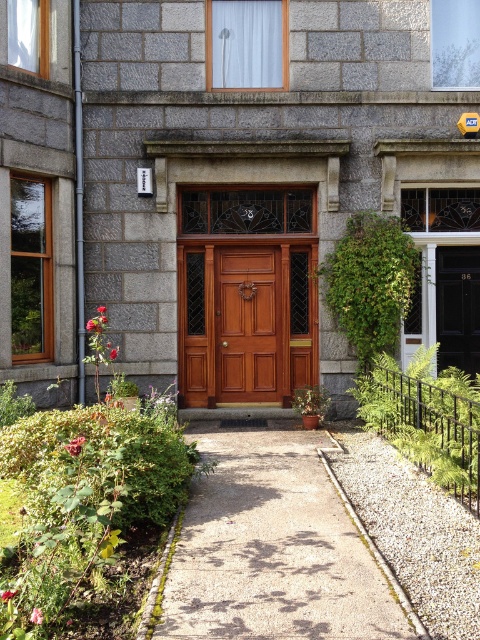
You are standing at the entrance of the stone building and want to locate two specific points marked on the door. The first point is at coordinates point (222, 632) and the second is at point (276, 316). From your perspective, which point appears closer to you?

Point (222, 632) is in front of point (276, 316), so it appears closer to you.